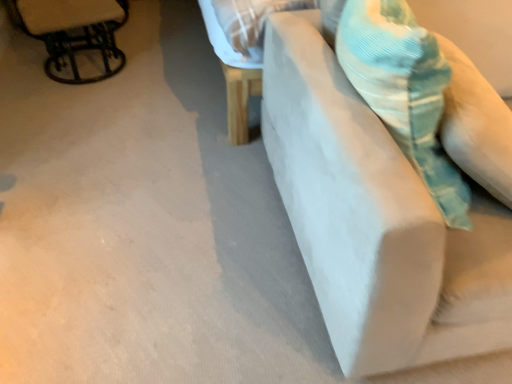
Question: Does metallic black chair at upper left appear on the right side of white fabric couch at right?

Choices:
 (A) no
 (B) yes

Answer: (A)

Question: Is metallic black chair at upper left to the left of white fabric couch at right from the viewer's perspective?

Choices:
 (A) no
 (B) yes

Answer: (B)

Question: Does metallic black chair at upper left contain white fabric couch at right?

Choices:
 (A) yes
 (B) no

Answer: (B)

Question: Is metallic black chair at upper left bigger than white fabric couch at right?

Choices:
 (A) yes
 (B) no

Answer: (B)

Question: From a real-world perspective, is metallic black chair at upper left below white fabric couch at right?

Choices:
 (A) yes
 (B) no

Answer: (A)

Question: From the image's perspective, is metallic black chair at upper left under white fabric couch at right?

Choices:
 (A) yes
 (B) no

Answer: (B)

Question: Is white fabric couch at right positioned with its back to metallic black chair at upper left?

Choices:
 (A) no
 (B) yes

Answer: (A)

Question: Is white fabric couch at right directly adjacent to metallic black chair at upper left?

Choices:
 (A) yes
 (B) no

Answer: (B)

Question: Could you tell me if white fabric couch at right is turned towards metallic black chair at upper left?

Choices:
 (A) no
 (B) yes

Answer: (A)

Question: Is white fabric couch at right closer to the viewer compared to metallic black chair at upper left?

Choices:
 (A) yes
 (B) no

Answer: (A)

Question: Does white fabric couch at right have a greater height compared to metallic black chair at upper left?

Choices:
 (A) no
 (B) yes

Answer: (B)

Question: Is white fabric couch at right thinner than metallic black chair at upper left?

Choices:
 (A) yes
 (B) no

Answer: (B)

Question: Is corduroy teal throw pillow at upper right surrounding metallic black chair at upper left?

Choices:
 (A) yes
 (B) no

Answer: (B)